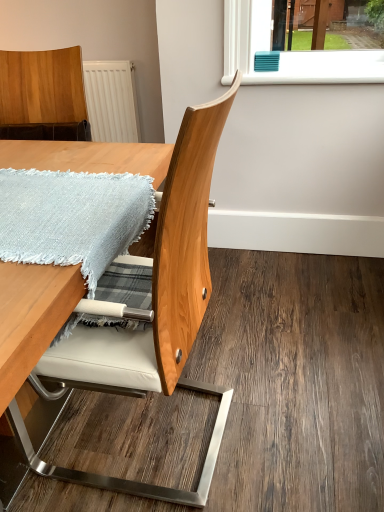
Question: Is white plastic window sill at upper center situated inside light blue woven blanket at lower left or outside?

Choices:
 (A) inside
 (B) outside

Answer: (B)

Question: Is white plastic window sill at upper center bigger or smaller than light blue woven blanket at lower left?

Choices:
 (A) small
 (B) big

Answer: (B)

Question: Considering the real-world distances, which object is closest to the white plastic window sill at upper center?

Choices:
 (A) wooden chair at lower right
 (B) wooden chair at center
 (C) light blue woven blanket at lower left
 (D) wooden table at center

Answer: (D)

Question: Estimate the real-world distances between objects in this image. Which object is closer to the wooden table at center?

Choices:
 (A) wooden chair at center
 (B) wooden chair at lower right
 (C) light blue woven blanket at lower left
 (D) white plastic window sill at upper center

Answer: (C)